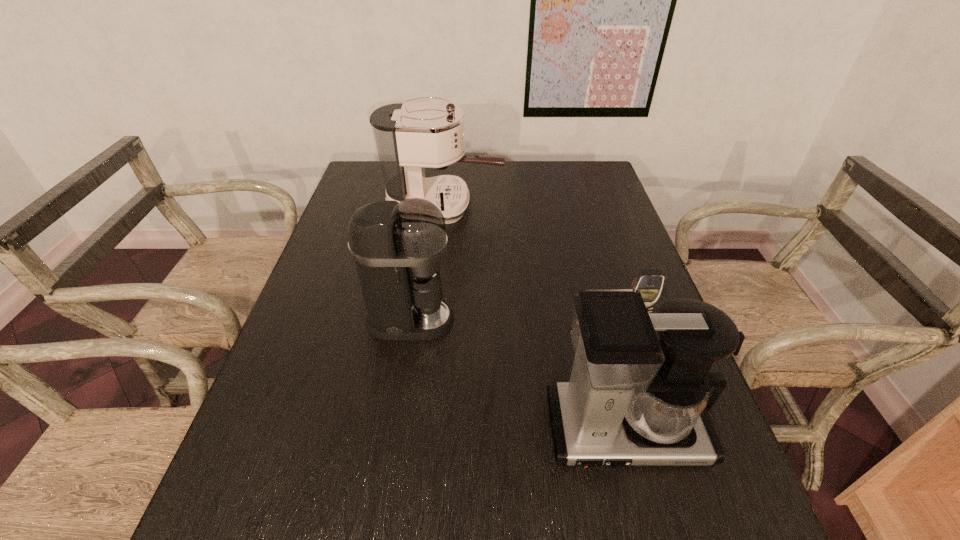
I want to click on object that is at the left edge, so click(409, 136).

The height and width of the screenshot is (540, 960). Identify the location of coffee maker located at the right edge. (632, 399).

Locate an element on the screen. cellular telephone positioned at the right edge is located at coordinates (649, 282).

Find the location of a particular element. The width and height of the screenshot is (960, 540). object that is positioned at the far left corner is located at coordinates (409, 136).

Where is `free space at the far edge of the desktop`? This screenshot has height=540, width=960. free space at the far edge of the desktop is located at coordinates (507, 172).

Where is `free space at the left edge`? The image size is (960, 540). free space at the left edge is located at coordinates (262, 414).

Locate an element on the screen. free space at the right edge is located at coordinates (660, 517).

The width and height of the screenshot is (960, 540). What are the coordinates of `free space that is in between the second farthest coffee maker and the nearest coffee maker` in the screenshot? It's located at (517, 375).

This screenshot has width=960, height=540. I want to click on unoccupied position between the nearest coffee maker and the farthest coffee maker, so click(535, 318).

Where is `vacant area between the nearest coffee maker and the farthest object`? vacant area between the nearest coffee maker and the farthest object is located at coordinates (535, 318).